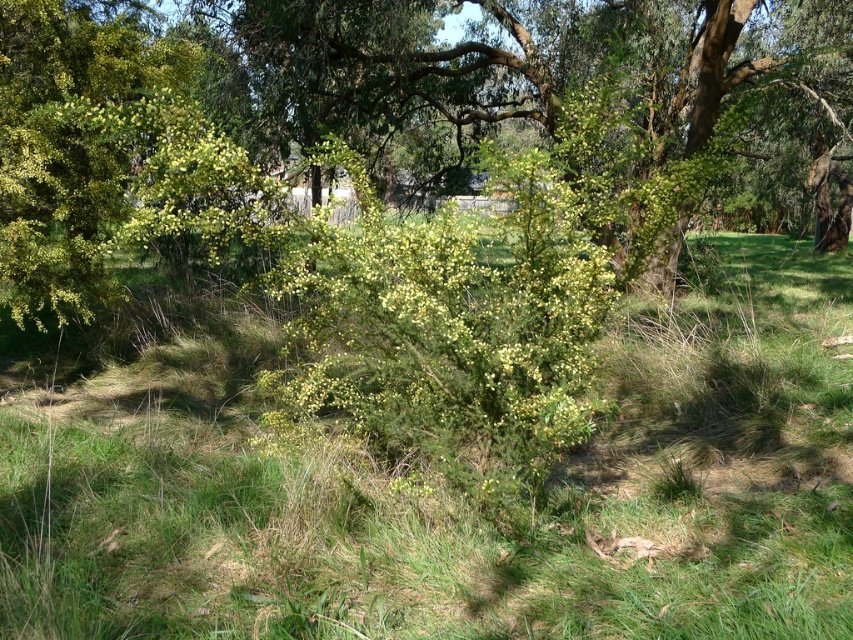
Consider the image. Is green grassy at center taller than green leafy bush at center?

No, green grassy at center is not taller than green leafy bush at center.

Is green grassy at center thinner than green leafy bush at center?

Indeed, green grassy at center has a lesser width compared to green leafy bush at center.

Which is behind, point (219, 392) or point (311, 93)?

Positioned behind is point (311, 93).

I want to click on green grassy at center, so click(x=451, y=493).